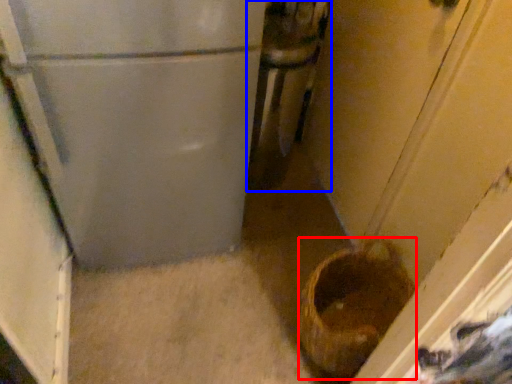
Question: Which point is closer to the camera, basket container (highlighted by a red box) or appliance (highlighted by a blue box)?

Choices:
 (A) basket container
 (B) appliance

Answer: (A)